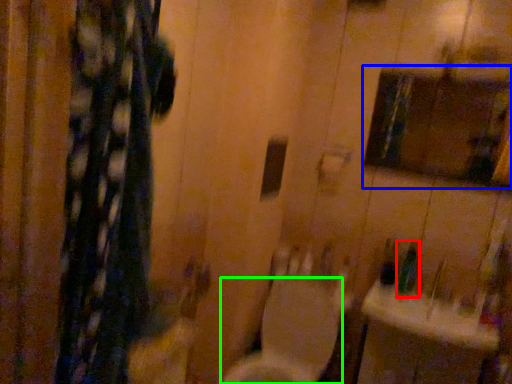
Question: Which is farther away from toiletry (highlighted by a red box)? medicine cabinet (highlighted by a blue box) or toilet (highlighted by a green box)?

Choices:
 (A) medicine cabinet
 (B) toilet

Answer: (A)